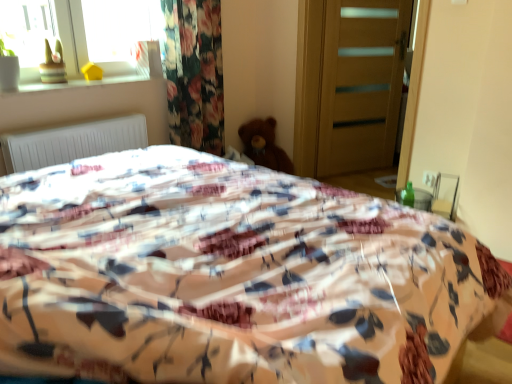
The width and height of the screenshot is (512, 384). What do you see at coordinates (72, 142) in the screenshot?
I see `white matte radiator at upper left` at bounding box center [72, 142].

In order to face brown plush teddy bear at center, should I rotate leftwards or rightwards?

It's best to rotate right around 0.186 degrees.

This screenshot has width=512, height=384. What are the coordinates of `floral fabric bed at center` in the screenshot? It's located at click(228, 276).

At what (x,y) coordinates should I click in order to perform the action: click on wooden toy at upper left. Please return your answer as a coordinate pair (x, y). The width and height of the screenshot is (512, 384). Looking at the image, I should click on (53, 65).

Which of these two, wooden toy at upper left or white matte radiator at upper left, stands taller?

wooden toy at upper left.

How distant is wooden toy at upper left from white matte radiator at upper left?

wooden toy at upper left and white matte radiator at upper left are 40.82 centimeters apart from each other.

Based on their positions, is wooden toy at upper left located to the left or right of white matte radiator at upper left?

Based on their positions, wooden toy at upper left is located to the left of white matte radiator at upper left.

Is wooden toy at upper left not within white matte radiator at upper left?

Yes, wooden toy at upper left is located beyond the bounds of white matte radiator at upper left.

Is the depth of wooden toy at upper left less than that of floral fabric bed at center?

That is False.

Can you see wooden toy at upper left touching floral fabric bed at center?

No.

Can you see matte yellow vase at upper left touching floral fabric bed at center?

No, matte yellow vase at upper left is not with floral fabric bed at center.

Considering the relative sizes of matte yellow vase at upper left and floral fabric bed at center in the image provided, is matte yellow vase at upper left wider than floral fabric bed at center?

Incorrect, the width of matte yellow vase at upper left does not surpass that of floral fabric bed at center.

Between matte yellow vase at upper left and floral fabric bed at center, which one has more height?

floral fabric bed at center is taller.

Considering the relative positions of matte yellow vase at upper left and floral fabric bed at center in the image provided, is matte yellow vase at upper left to the right of floral fabric bed at center from the viewer's perspective?

Incorrect, matte yellow vase at upper left is not on the right side of floral fabric bed at center.

Are wooden door at center and white matte radiator at upper left beside each other?

There is a gap between wooden door at center and white matte radiator at upper left.

Is white matte radiator at upper left located within wooden door at center?

No.

Based on the photo, is wooden door at center shorter than white matte radiator at upper left?

In fact, wooden door at center may be taller than white matte radiator at upper left.

In the scene shown: From a real-world perspective, is wooden toy at upper left under transparent glass window at upper left?

Yes.

Which is closer to the camera, [49,76] or [0,16]?

Clearly, point [49,76] is more distant from the camera than point [0,16].

Which of these two, wooden toy at upper left or transparent glass window at upper left, is bigger?

transparent glass window at upper left is bigger.

Consider the image. Could you tell me if wooden toy at upper left is facing transparent glass window at upper left?

No, wooden toy at upper left is not turned towards transparent glass window at upper left.

Where is `window behind the matte yellow vase at upper left`? window behind the matte yellow vase at upper left is located at coordinates (79, 33).

Does transparent glass window at upper left have a greater height compared to matte yellow vase at upper left?

Indeed, transparent glass window at upper left has a greater height compared to matte yellow vase at upper left.

Does transparent glass window at upper left have a lesser width compared to matte yellow vase at upper left?

Yes, transparent glass window at upper left is thinner than matte yellow vase at upper left.

Is floral fabric bed at center in front of or behind brown plush teddy bear at center in the image?

floral fabric bed at center is in front of brown plush teddy bear at center.

Would you say floral fabric bed at center is a long distance from brown plush teddy bear at center?

That's right, there is a large distance between floral fabric bed at center and brown plush teddy bear at center.

Which of these two, floral fabric bed at center or brown plush teddy bear at center, stands taller?

floral fabric bed at center.

Where is `toy above the white matte radiator at upper left (from the image's perspective)`? The image size is (512, 384). toy above the white matte radiator at upper left (from the image's perspective) is located at coordinates (53, 65).

This screenshot has width=512, height=384. In order to click on toy that is behind the floral fabric bed at center in this screenshot , I will do coord(53,65).

Looking at the image, which one is located further to wooden door at center, matte yellow vase at upper left or white matte radiator at upper left?

Among the two, matte yellow vase at upper left is located further to wooden door at center.

Based on their spatial positions, is transparent glass window at upper left or wooden door at center closer to floral fabric bed at center?

Based on the image, transparent glass window at upper left appears to be nearer to floral fabric bed at center.

Looking at the image, which one is located further to floral fabric bed at center, white matte radiator at upper left or transparent glass window at upper left?

Based on the image, transparent glass window at upper left appears to be further to floral fabric bed at center.

Considering their positions, is brown plush teddy bear at center positioned closer to wooden toy at upper left than wooden door at center?

brown plush teddy bear at center lies closer to wooden toy at upper left than the other object.

Considering their positions, is wooden door at center positioned closer to floral fabric bed at center than matte yellow vase at upper left?

matte yellow vase at upper left is positioned closer to the anchor floral fabric bed at center.

Looking at the image, which one is located closer to matte yellow vase at upper left, wooden toy at upper left or transparent glass window at upper left?

wooden toy at upper left.

Looking at the image, which one is located closer to wooden door at center, matte yellow vase at upper left or wooden toy at upper left?

Among the two, matte yellow vase at upper left is located nearer to wooden door at center.

Looking at this image, looking at the image, which one is located closer to matte yellow vase at upper left, wooden door at center or wooden toy at upper left?

wooden toy at upper left.

The width and height of the screenshot is (512, 384). In order to click on teddy located between white matte radiator at upper left and wooden door at center in the left-right direction in this screenshot , I will do `click(264, 145)`.

At what (x,y) coordinates should I click in order to perform the action: click on window screen positioned between floral fabric bed at center and white matte radiator at upper left from near to far. Please return your answer as a coordinate pair (x, y). Looking at the image, I should click on (28, 28).

Where is `teddy located between floral fabric bed at center and wooden door at center in the depth direction`? This screenshot has height=384, width=512. teddy located between floral fabric bed at center and wooden door at center in the depth direction is located at coordinates (264, 145).

Where is `window screen between transparent glass window at upper left and white matte radiator at upper left vertically`? window screen between transparent glass window at upper left and white matte radiator at upper left vertically is located at coordinates (28, 28).